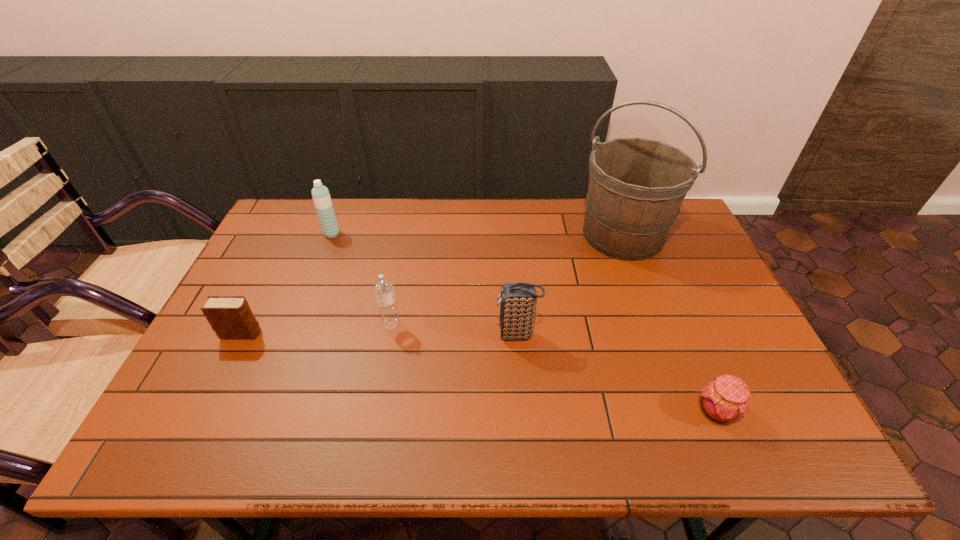
Image resolution: width=960 pixels, height=540 pixels. In order to click on empty location between the clutch bag and the farther water bottle in this screenshot , I will do `click(424, 284)`.

Where is `unoccupied position between the tallest object and the second shortest object`? The image size is (960, 540). unoccupied position between the tallest object and the second shortest object is located at coordinates (432, 285).

Where is `unoccupied position between the bucket and the fifth tallest object`? The image size is (960, 540). unoccupied position between the bucket and the fifth tallest object is located at coordinates 432,285.

The width and height of the screenshot is (960, 540). I want to click on vacant region between the nearer water bottle and the left water bottle, so click(361, 279).

Find the location of `unoccupied position between the right water bottle and the tallest object`. unoccupied position between the right water bottle and the tallest object is located at coordinates (507, 280).

Identify the location of blank region between the bucket and the clutch bag. (570, 285).

This screenshot has width=960, height=540. Identify the location of vacant area that lies between the left water bottle and the leftmost object. (287, 284).

This screenshot has height=540, width=960. What are the coordinates of `vacant space that is in between the third object from right to left and the fourth object from right to left` in the screenshot? It's located at (454, 329).

You are a GUI agent. You are given a task and a screenshot of the screen. Output one action in this format:
    pyautogui.click(x=<x>, y=<y>)
    Task: Click on the vacant area that lies between the tallest object and the diary
    
    Given the screenshot: What is the action you would take?
    pyautogui.click(x=432, y=285)

Image resolution: width=960 pixels, height=540 pixels. What are the coordinates of `free space between the leftmost object and the clutch bag` in the screenshot? It's located at (379, 334).